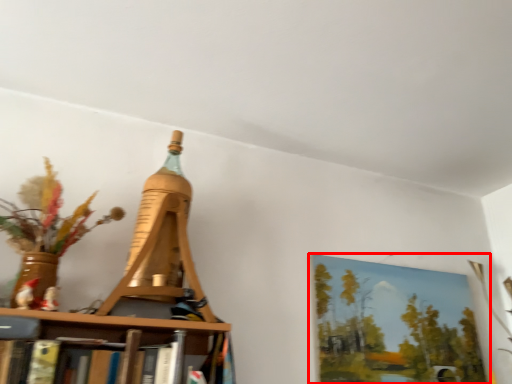
Question: From the image's perspective, what is the correct spatial relationship of picture frame (annotated by the red box) in relation to Eiffel tower?

Choices:
 (A) above
 (B) below

Answer: (B)